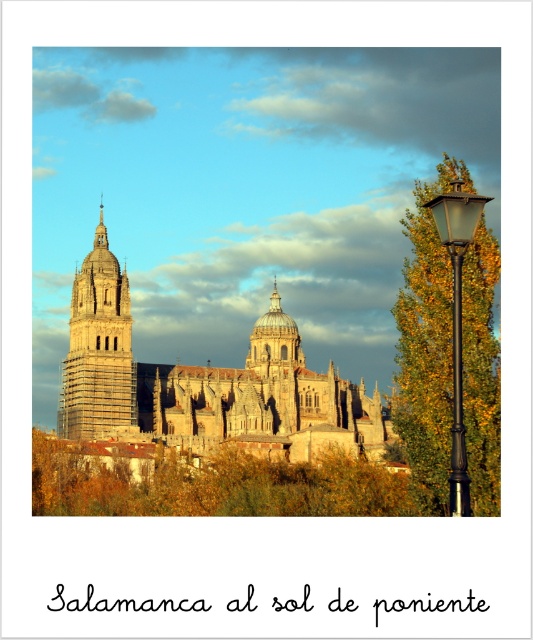
Which is below, yellow-green foliage at center or black metal lamp post at right?

Positioned lower is yellow-green foliage at center.

Between yellow-green foliage at center and black metal lamp post at right, which one is positioned higher?

Positioned higher is black metal lamp post at right.

Which is in front, point (35, 458) or point (454, 240)?

Point (454, 240)

The image size is (533, 640). Find the location of `yellow-green foliage at center`. yellow-green foliage at center is located at coordinates (215, 486).

Is stone tower at center to the left of black metal lamp post at right from the viewer's perspective?

Correct, you'll find stone tower at center to the left of black metal lamp post at right.

Can you confirm if stone tower at center is smaller than black metal lamp post at right?

Actually, stone tower at center might be larger than black metal lamp post at right.

Where is `stone tower at center`? This screenshot has height=640, width=533. stone tower at center is located at coordinates (99, 349).

Is the position of yellow-green foliage at center more distant than that of stone tower at center?

No, it is not.

Identify the location of yellow-green foliage at center. (215, 486).

Is point (261, 513) positioned in front of point (117, 358)?

Yes, point (261, 513) is in front of point (117, 358).

Image resolution: width=533 pixels, height=640 pixels. Find the location of `yellow-green foliage at center`. yellow-green foliage at center is located at coordinates (215, 486).